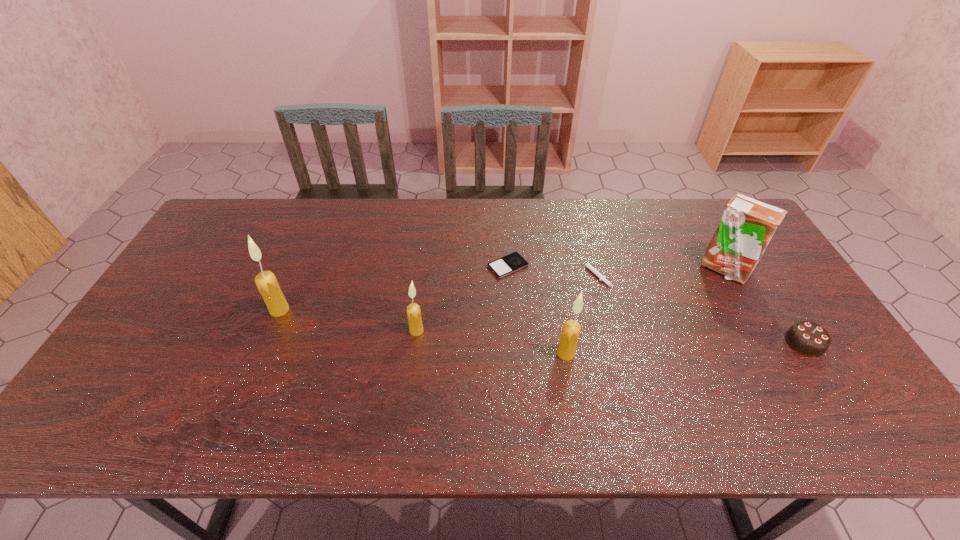
Given the evenly spaced candles in the image, where should an extra candle be added on the right to preserve the spacing? Please point to a vacant space. Please provide its 2D coordinates. Your answer should be formatted as a tuple, i.e. [(x, y)], where the tuple contains the x and y coordinates of a point satisfying the conditions above.

[(730, 379)]